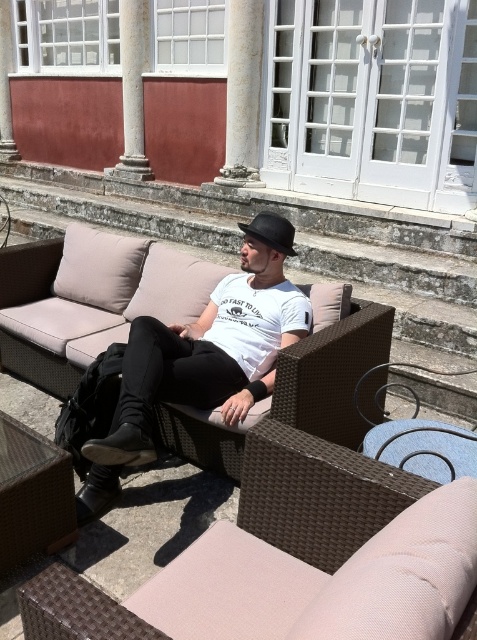
Question: Which object appears farthest from the camera in this image?

Choices:
 (A) brown wicker side table at lower left
 (B) matte white t-shirt at center
 (C) black felt hat at center
 (D) pale pink fabric chair at center

Answer: (C)

Question: Does matte white t-shirt at center appear on the left side of white stone column at center?

Choices:
 (A) yes
 (B) no

Answer: (A)

Question: Is white matte t-shirt at center to the right of black felt hat at center from the viewer's perspective?

Choices:
 (A) yes
 (B) no

Answer: (B)

Question: Can you confirm if white matte t-shirt at center is positioned above smooth stone column at upper left?

Choices:
 (A) no
 (B) yes

Answer: (A)

Question: Which point is closer to the camera taking this photo?

Choices:
 (A) (265, 241)
 (B) (456, 502)
 (C) (246, 273)

Answer: (B)

Question: Which point appears farthest from the camera in this image?

Choices:
 (A) (124, 33)
 (B) (167, 332)

Answer: (A)